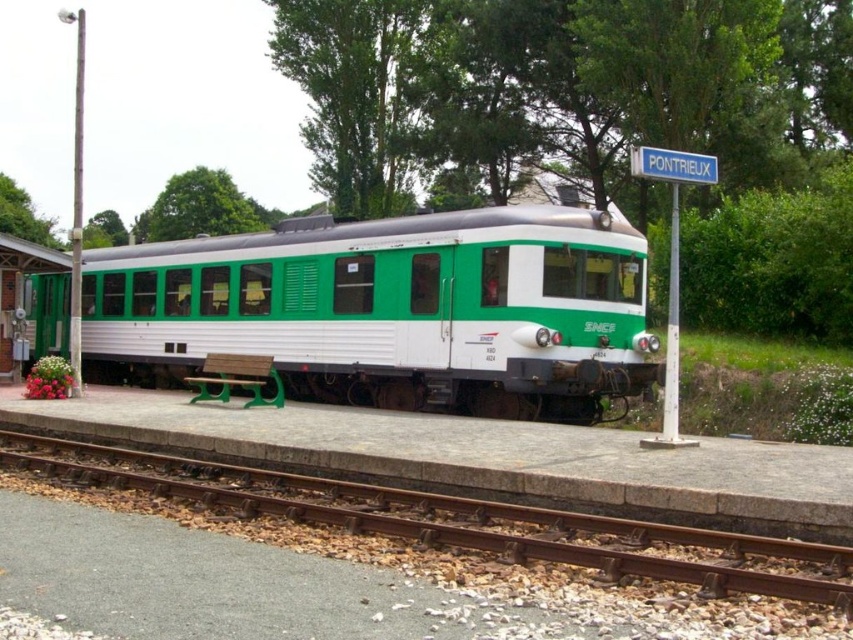
Question: From the image, what is the correct spatial relationship of green matte train at center in relation to rusty metal track at lower left?

Choices:
 (A) below
 (B) above

Answer: (B)

Question: Does green matte train at center appear on the right side of rusty metal track at lower left?

Choices:
 (A) no
 (B) yes

Answer: (A)

Question: Which point is closer to the camera?

Choices:
 (A) rusty metal track at lower left
 (B) green matte train at center

Answer: (A)

Question: Which object appears farthest from the camera in this image?

Choices:
 (A) green matte train at center
 (B) rusty metal track at lower left

Answer: (A)

Question: Can you confirm if green matte train at center is positioned below rusty metal track at lower left?

Choices:
 (A) no
 (B) yes

Answer: (A)